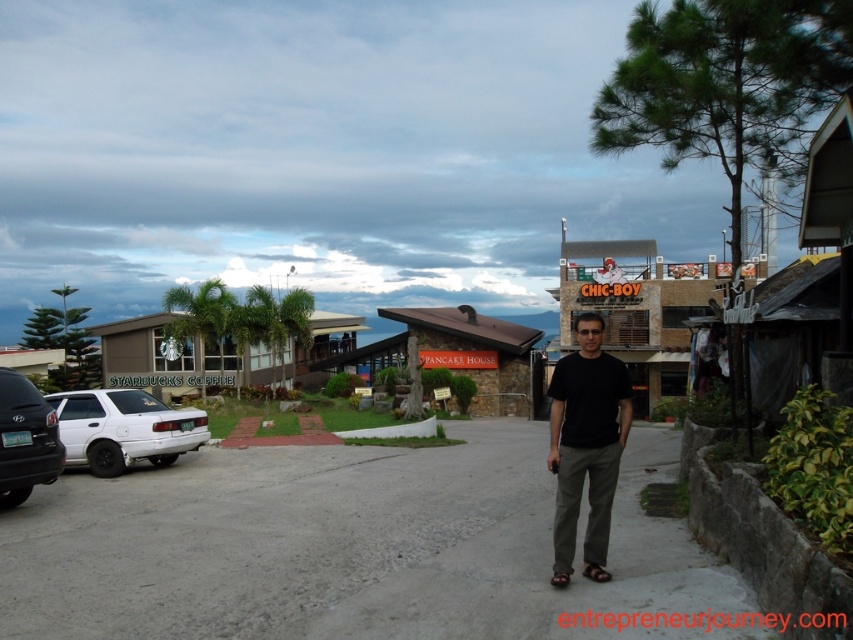
You are a photographer trying to capture both the black matte shirt at center and the matte black car at left in a single frame. Considering their sizes, which object would appear bigger in your photo?

The black matte shirt at center would appear bigger in the photo because it has a larger size compared to the matte black car at left.

You are a customer trying to find your sandals in a store. You see two brown leather sandals in the store display. One is labeled as the brown leather sandal at center and the other as the brown leather sandal at lower right. Which one should you choose if you prefer a larger size?

The brown leather sandal at center is larger in size than the brown leather sandal at lower right, so you should choose the brown leather sandal at center if you prefer a larger size.